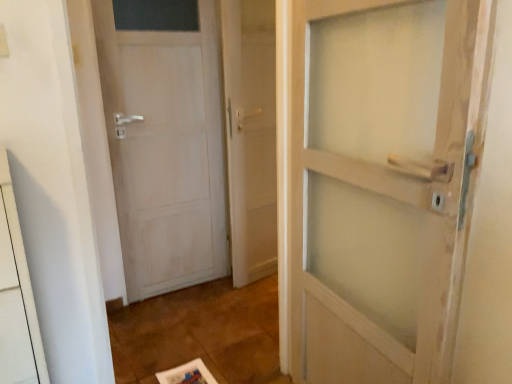
Question: Looking at the image, does white matte door at left seem bigger or smaller compared to clear glass door at center?

Choices:
 (A) small
 (B) big

Answer: (B)

Question: Is point (161, 44) positioned closer to the camera than point (242, 112)?

Choices:
 (A) farther
 (B) closer

Answer: (B)

Question: From the image's perspective, relative to clear glass door at center, is white matte door at left above or below?

Choices:
 (A) above
 (B) below

Answer: (B)

Question: Relative to white matte door at left, is clear glass door at center in front or behind?

Choices:
 (A) front
 (B) behind

Answer: (B)

Question: From the image's perspective, is clear glass door at center positioned above or below white matte door at left?

Choices:
 (A) below
 (B) above

Answer: (B)

Question: In terms of width, does clear glass door at center look wider or thinner when compared to white matte door at left?

Choices:
 (A) wide
 (B) thin

Answer: (A)

Question: From a real-world perspective, is clear glass door at center positioned above or below white matte door at left?

Choices:
 (A) below
 (B) above

Answer: (B)